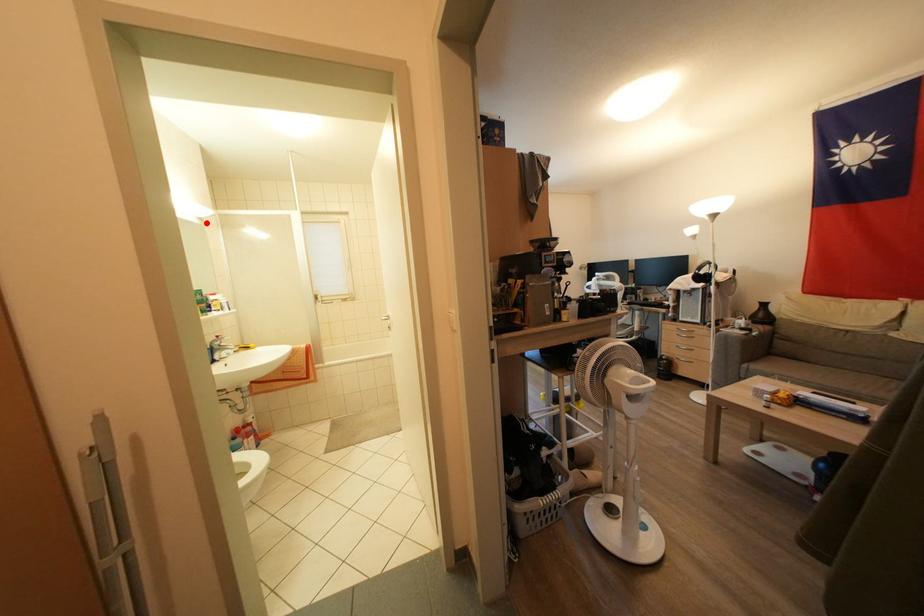
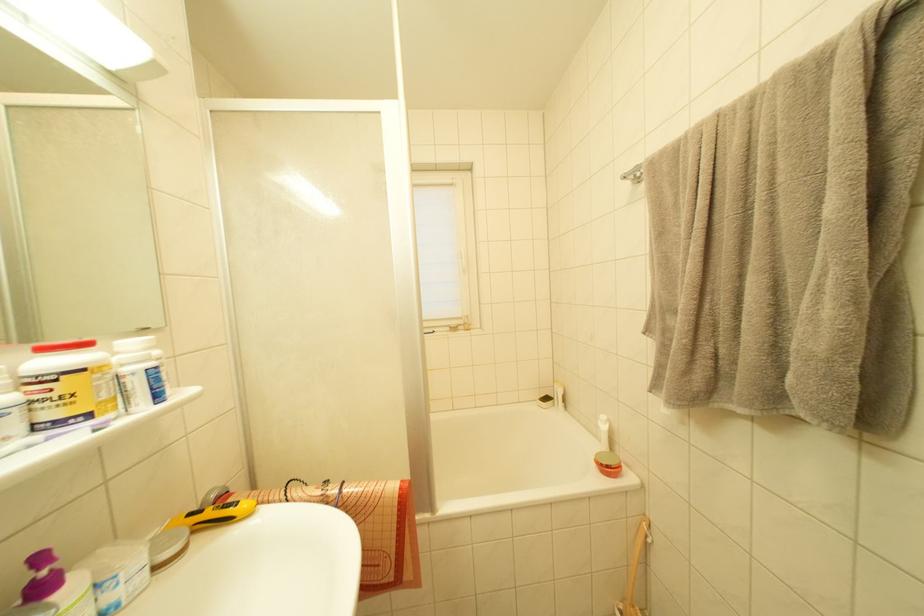
Where in the second image is the point corresponding to the highlighted location from the first image?

(127, 84)